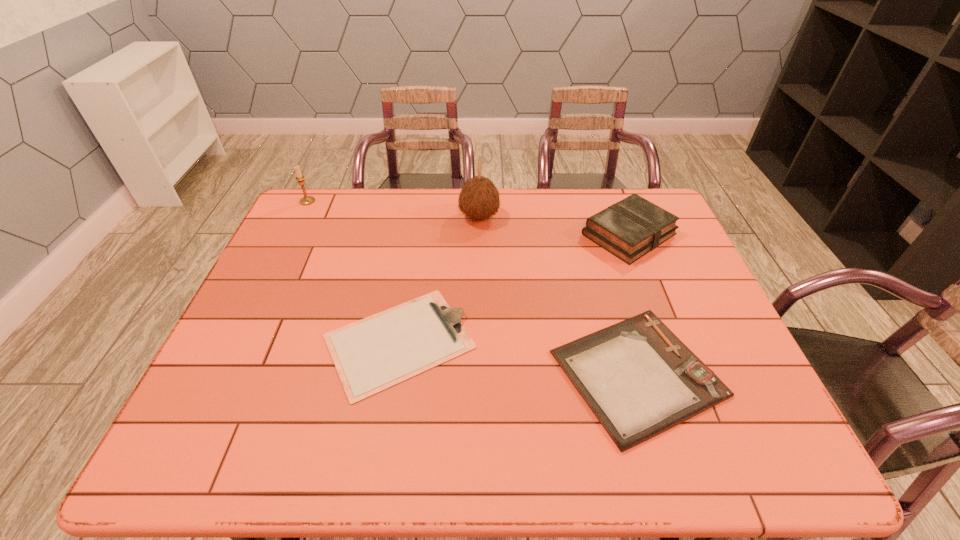
At what (x,y) coordinates should I click in order to perform the action: click on blank area in the image that satisfies the following two spatial constraints: 1. on the front side of the right clipboard; 2. on the left side of the left clipboard. Please return your answer as a coordinate pair (x, y). Image resolution: width=960 pixels, height=540 pixels. Looking at the image, I should click on (395, 373).

Image resolution: width=960 pixels, height=540 pixels. What are the coordinates of `free space that satisfies the following two spatial constraints: 1. on the back side of the right clipboard; 2. on the surface of the coconut` in the screenshot? It's located at (590, 217).